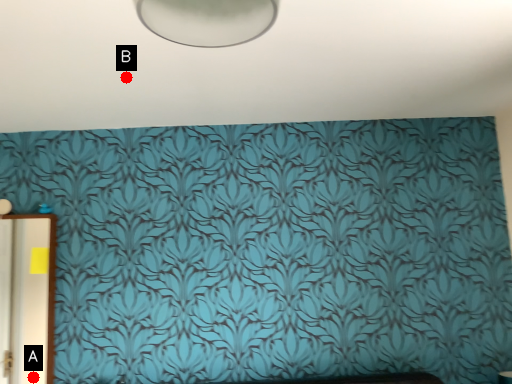
Question: Two points are circled on the image, labeled by A and B beside each circle. Which point is further to the camera?

Choices:
 (A) A is further
 (B) B is further

Answer: (A)